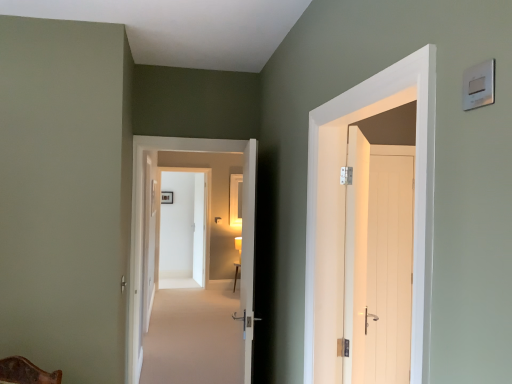
Question: From the image's perspective, is silver metallic light switch at upper right beneath white wood door at right, the fourth door from the front?

Choices:
 (A) no
 (B) yes

Answer: (A)

Question: Does silver metallic light switch at upper right have a greater height compared to white wood door at right, the 1th door from the right?

Choices:
 (A) no
 (B) yes

Answer: (A)

Question: Considering the relative sizes of silver metallic light switch at upper right and white wood door at right, the 1th door from the right, in the image provided, is silver metallic light switch at upper right bigger than white wood door at right, the 1th door from the right,?

Choices:
 (A) no
 (B) yes

Answer: (A)

Question: Can you confirm if silver metallic light switch at upper right is positioned to the left of white wood door at right, the 6th door when ordered from left to right?

Choices:
 (A) yes
 (B) no

Answer: (A)

Question: Can you confirm if silver metallic light switch at upper right is shorter than white wood door at right, the third door viewed from the back?

Choices:
 (A) yes
 (B) no

Answer: (A)

Question: Based on their sizes in the image, would you say white glossy door at center, acting as the third door starting from the front, is bigger or smaller than white wooden door at center, which is the 3th door from right to left?

Choices:
 (A) small
 (B) big

Answer: (A)

Question: Considering their positions, is white glossy door at center, acting as the third door starting from the front, located in front of or behind white wooden door at center, placed as the 4th door when sorted from left to right?

Choices:
 (A) behind
 (B) front

Answer: (A)

Question: Does point (154, 137) appear closer or farther from the camera than point (242, 311)?

Choices:
 (A) closer
 (B) farther

Answer: (B)

Question: Is white glossy door at center, positioned as the third door in left-to-right order, situated inside white wooden door at center, the second door viewed from the front, or outside?

Choices:
 (A) inside
 (B) outside

Answer: (B)

Question: Is point (237, 263) positioned closer to the camera than point (186, 268)?

Choices:
 (A) closer
 (B) farther

Answer: (B)

Question: Is wooden table at center inside or outside of white glossy door at center, the 6th door viewed from the right?

Choices:
 (A) outside
 (B) inside

Answer: (A)

Question: In terms of height, does wooden table at center look taller or shorter compared to white glossy door at center, the 6th door viewed from the right?

Choices:
 (A) short
 (B) tall

Answer: (A)

Question: Considering the positions of wooden table at center and white glossy door at center, placed as the 1th door when sorted from left to right, in the image, is wooden table at center wider or thinner than white glossy door at center, placed as the 1th door when sorted from left to right,?

Choices:
 (A) thin
 (B) wide

Answer: (B)

Question: From a real-world perspective, is white wooden door at upper right, positioned as the 5th door in left-to-right order, physically located above or below silver metallic light switch at upper right?

Choices:
 (A) above
 (B) below

Answer: (B)

Question: From the image's perspective, is white wooden door at upper right, which appears as the sixth door when viewed from the back, located above or below silver metallic light switch at upper right?

Choices:
 (A) above
 (B) below

Answer: (B)